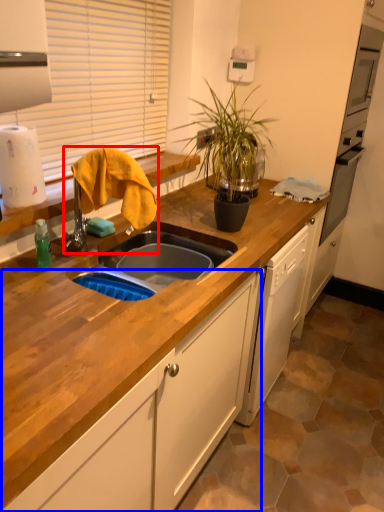
Question: Which point is closer to the camera, faucet (highlighted by a red box) or cabinetry (highlighted by a blue box)?

Choices:
 (A) faucet
 (B) cabinetry

Answer: (B)